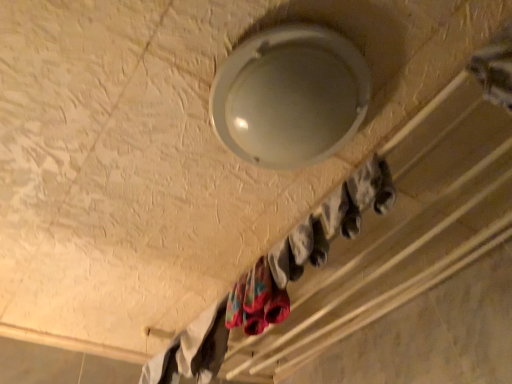
Question: Can you confirm if white cotton socks at lower left, the first clothing positioned from the bottom, is smaller than multicolored fabric socks at lower center, arranged as the second clothing when viewed from the back?

Choices:
 (A) no
 (B) yes

Answer: (A)

Question: Is white cotton socks at lower left, which is the first clothing in left-to-right order, wider than multicolored fabric socks at lower center, acting as the 1th clothing starting from the right?

Choices:
 (A) no
 (B) yes

Answer: (B)

Question: Does white cotton socks at lower left, which is the first clothing in left-to-right order, have a larger size compared to multicolored fabric socks at lower center, acting as the 1th clothing starting from the right?

Choices:
 (A) no
 (B) yes

Answer: (B)

Question: Can you confirm if white cotton socks at lower left, which is the 2th clothing from front to back, is shorter than multicolored fabric socks at lower center, arranged as the second clothing when viewed from the back?

Choices:
 (A) no
 (B) yes

Answer: (B)

Question: From a real-world perspective, is white cotton socks at lower left, which is the 2th clothing from front to back, under multicolored fabric socks at lower center, arranged as the second clothing when viewed from the back?

Choices:
 (A) yes
 (B) no

Answer: (B)

Question: From a real-world perspective, is white cotton socks at lower left, arranged as the second clothing when viewed from the right, physically located above or below multicolored fabric socks at lower center, arranged as the second clothing when viewed from the back?

Choices:
 (A) above
 (B) below

Answer: (A)

Question: Looking at the image, does white cotton socks at lower left, arranged as the first clothing when viewed from the back, seem bigger or smaller compared to multicolored fabric socks at lower center, placed as the 2th clothing when sorted from bottom to top?

Choices:
 (A) small
 (B) big

Answer: (B)

Question: Considering the positions of point click(173, 349) and point click(260, 284), is point click(173, 349) closer or farther from the camera than point click(260, 284)?

Choices:
 (A) farther
 (B) closer

Answer: (A)

Question: Would you say white cotton socks at lower left, positioned as the second clothing in top-to-bottom order, is to the left or to the right of multicolored fabric socks at lower center, placed as the 2th clothing when sorted from bottom to top, in the picture?

Choices:
 (A) left
 (B) right

Answer: (A)

Question: Relative to white cotton socks at lower left, positioned as the second clothing in top-to-bottom order, is multicolored fabric socks at lower center, the first clothing from the top, in front or behind?

Choices:
 (A) front
 (B) behind

Answer: (A)

Question: Considering the positions of multicolored fabric socks at lower center, the first clothing from the top, and white cotton socks at lower left, which is the first clothing in left-to-right order, in the image, is multicolored fabric socks at lower center, the first clothing from the top, bigger or smaller than white cotton socks at lower left, which is the first clothing in left-to-right order,?

Choices:
 (A) big
 (B) small

Answer: (B)

Question: Based on their positions, is multicolored fabric socks at lower center, the 1th clothing viewed from the front, located to the left or right of white cotton socks at lower left, arranged as the second clothing when viewed from the right?

Choices:
 (A) right
 (B) left

Answer: (A)

Question: From the image's perspective, is multicolored fabric socks at lower center, the 1th clothing viewed from the front, positioned above or below white cotton socks at lower left, which is the first clothing in left-to-right order?

Choices:
 (A) below
 (B) above

Answer: (B)

Question: Looking at their shapes, would you say white matte socks at upper center is wider or thinner than white cotton socks at lower left, which is the first clothing in left-to-right order?

Choices:
 (A) thin
 (B) wide

Answer: (B)

Question: Considering their positions, is white matte socks at upper center located in front of or behind white cotton socks at lower left, which is the first clothing in left-to-right order?

Choices:
 (A) front
 (B) behind

Answer: (A)